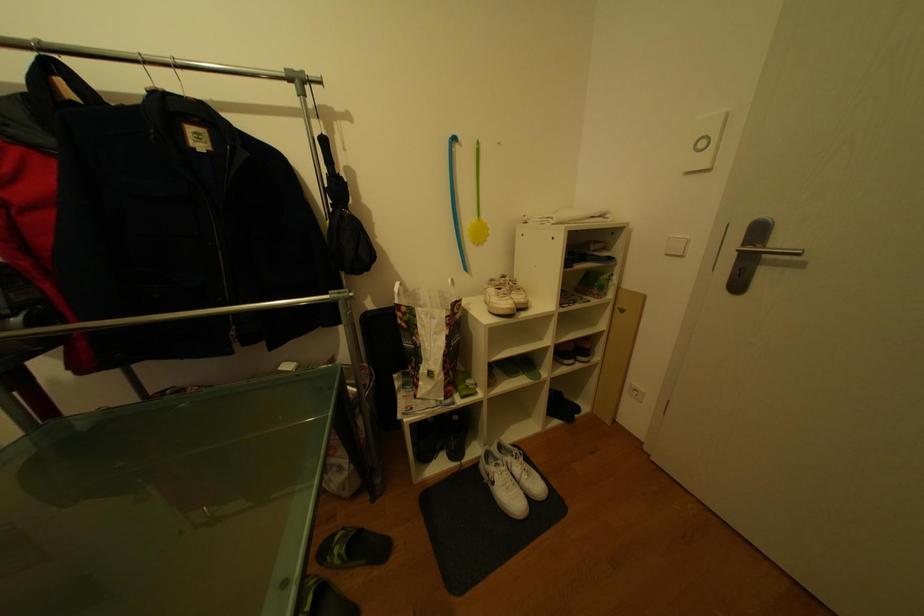
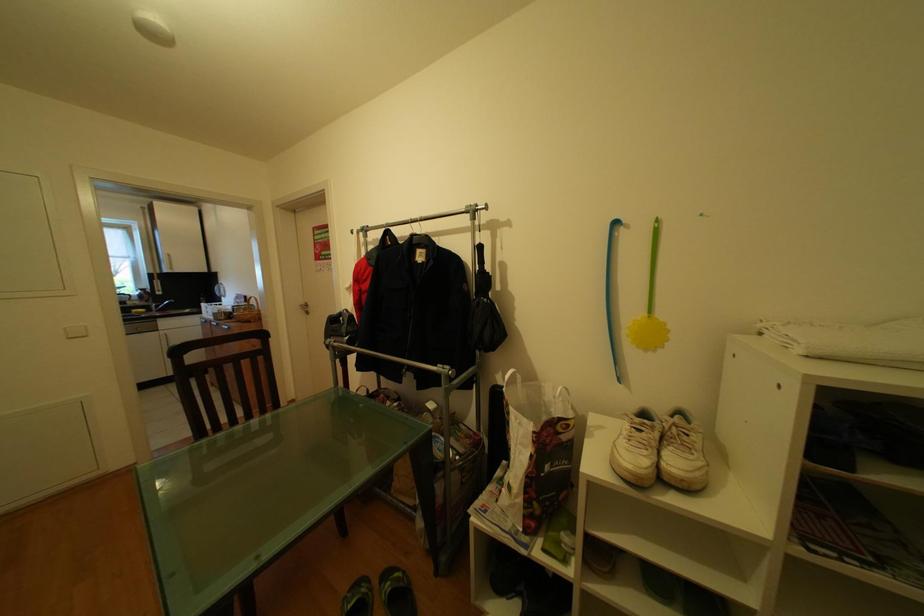
Question: Based on the continuous images, in which direction is the camera rotating? Reply with the corresponding letter.

Choices:
 (A) Left
 (B) Right
 (C) Up
 (D) Down

Answer: (A)